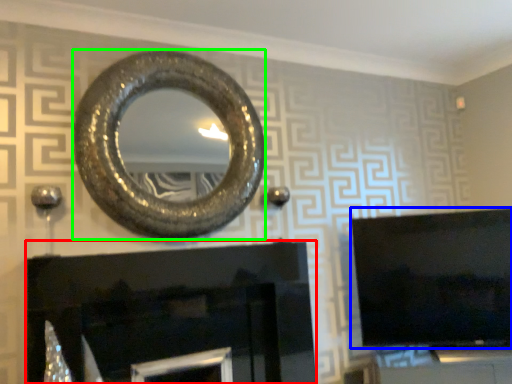
Question: Considering the real-world distances, which object is closest to fireplace (highlighted by a red box)? television (highlighted by a blue box) or oval (highlighted by a green box).

Choices:
 (A) television
 (B) oval

Answer: (B)